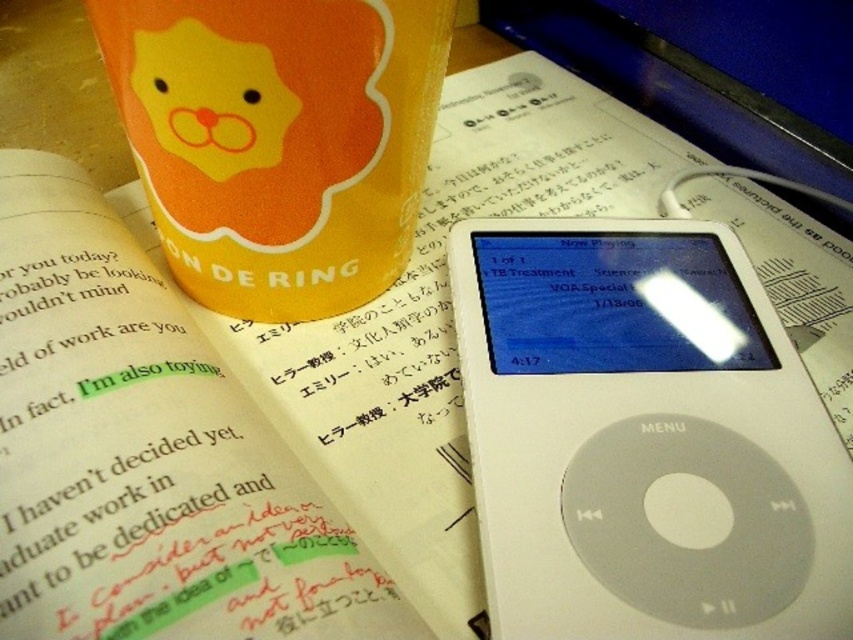
Between white plastic ipod at lower right and orange matte cup at upper left, which one is positioned lower?

Positioned lower is white plastic ipod at lower right.

Does point (648, 552) come behind point (196, 35)?

Yes, point (648, 552) is farther from viewer.

You are a GUI agent. You are given a task and a screenshot of the screen. Output one action in this format:
    pyautogui.click(x=<x>, y=<y>)
    Task: Click on the white plastic ipod at lower right
    
    Given the screenshot: What is the action you would take?
    pyautogui.click(x=642, y=442)

Locate an element on the screen. This screenshot has width=853, height=640. white plastic ipod at lower right is located at coordinates (642, 442).